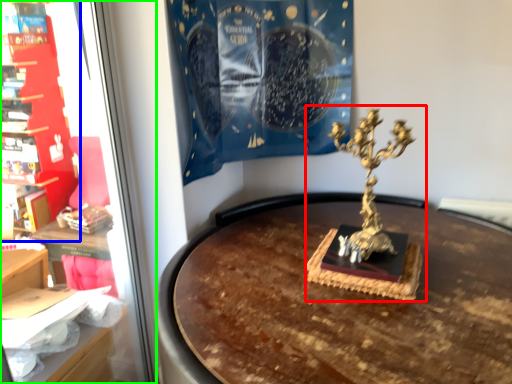
Question: Estimate the real-world distances between objects in this image. Which object is farther from sculpture (highlighted by a red box), furniture (highlighted by a blue box) or shop window (highlighted by a green box)?

Choices:
 (A) furniture
 (B) shop window

Answer: (A)